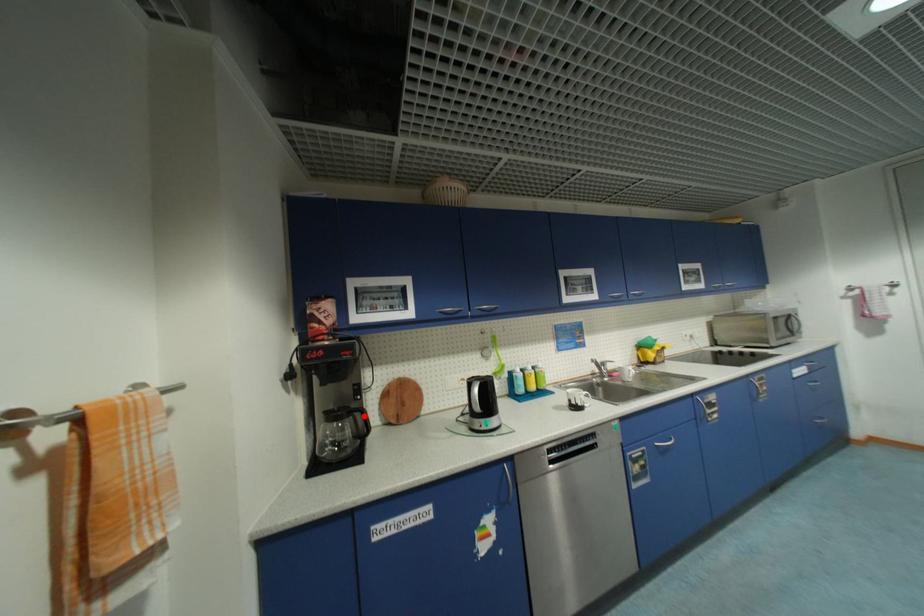
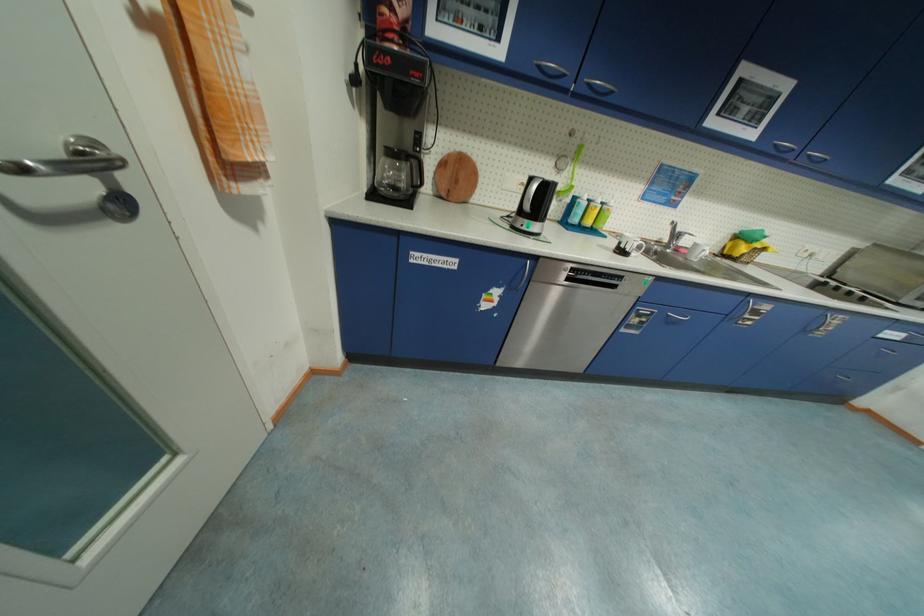
The point at the highlighted location is marked in the first image. Where is the corresponding point in the second image?

(420, 163)